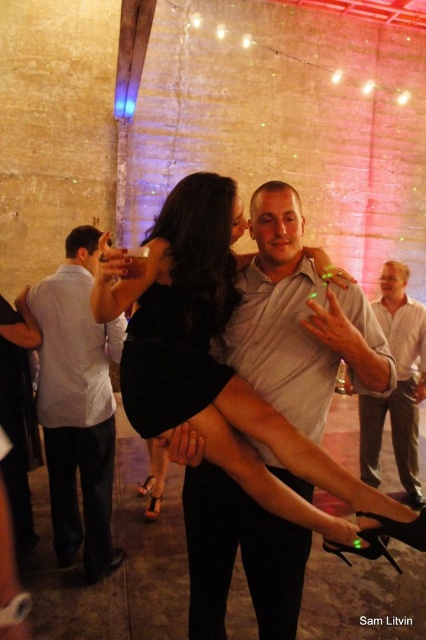
You are a photographer at the event and want to capture a photo of both the white cotton shirt at left and the white shirt at upper center in the same frame. Which shirt should you focus on first to ensure both are in the frame?

The white cotton shirt at left is much taller than the white shirt at upper center, so you should focus on the white shirt at upper center first to ensure both are in the frame.

You are a photographer at the event and need to capture a clear shot of both the matte white shirt at center and the white shirt at upper center. Which shirt should you focus on first to ensure it takes up more of the frame?

The white shirt at upper center should be focused on first because it occupies more space in the frame than the matte white shirt at center.